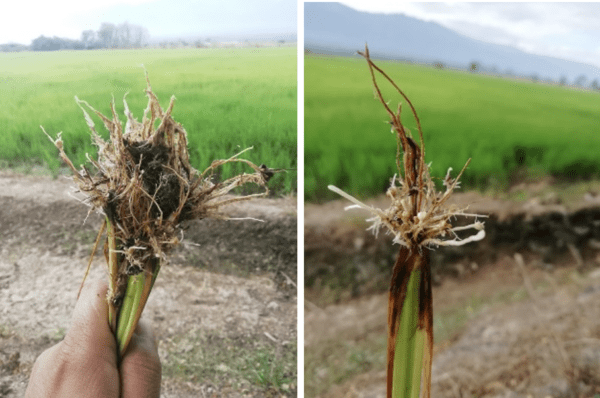
I want to click on plant, so click(132, 307).